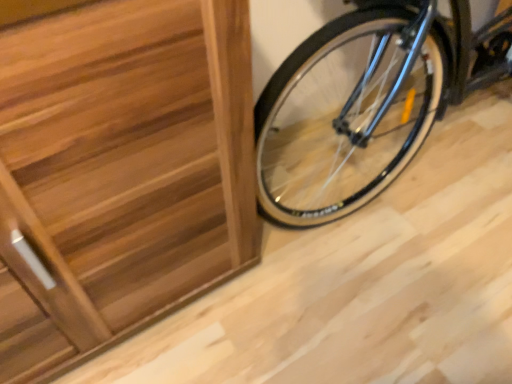
Identify the location of wooden at lower right. (122, 171).

Describe the element at coordinates (122, 171) in the screenshot. I see `wooden at lower right` at that location.

This screenshot has height=384, width=512. Identify the location of wooden at lower right. (122, 171).